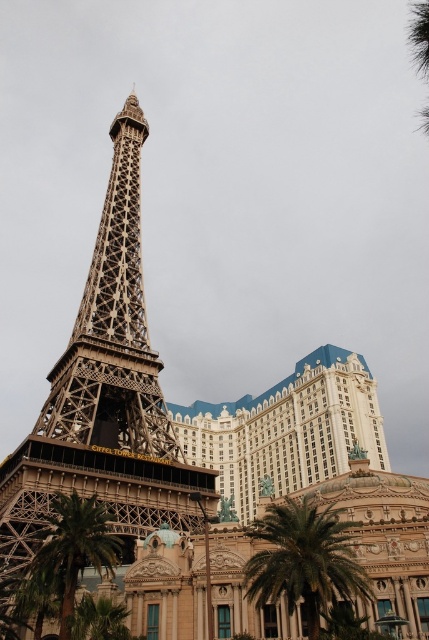
You are a visitor at the Paris Las Vegas hotel and see the metallic gold tower at center and the green leafy palm tree at center. Which object appears closer to the sky in the image?

The metallic gold tower at center is positioned over the green leafy palm tree at center, so it appears closer to the sky.

You are planning to take a photo of the metallic gold tower at center and the green leafy palm tree at center from a distance. Which object will appear larger in the photo?

The metallic gold tower at center will appear larger in the photo because it is much taller than the green leafy palm tree at center.